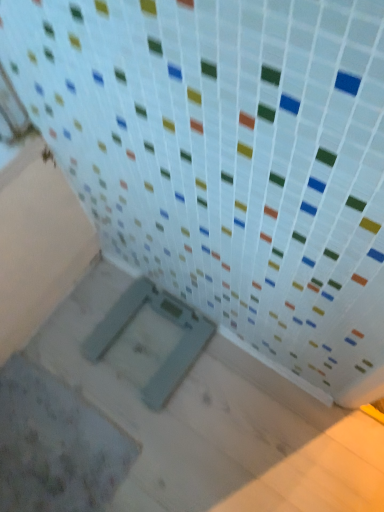
Locate an element on the screen. The width and height of the screenshot is (384, 512). matte gray scale at center is located at coordinates (166, 319).

Describe the element at coordinates (166, 319) in the screenshot. I see `matte gray scale at center` at that location.

Image resolution: width=384 pixels, height=512 pixels. Identify the location of matte gray scale at center. (166, 319).